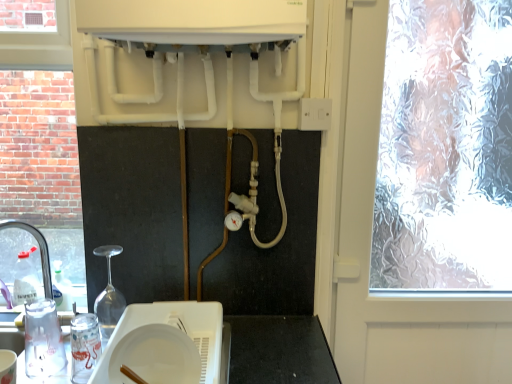
Question: Considering the relative sizes of white plastic switch at upper right and clear plastic tap at left in the image provided, is white plastic switch at upper right bigger than clear plastic tap at left?

Choices:
 (A) no
 (B) yes

Answer: (A)

Question: From a real-world perspective, does white plastic switch at upper right sit lower than clear plastic tap at left?

Choices:
 (A) no
 (B) yes

Answer: (A)

Question: Would you say white plastic switch at upper right is outside clear plastic tap at left?

Choices:
 (A) no
 (B) yes

Answer: (B)

Question: Are white plastic switch at upper right and clear plastic tap at left located far from each other?

Choices:
 (A) yes
 (B) no

Answer: (B)

Question: Is white plastic switch at upper right turned away from clear plastic tap at left?

Choices:
 (A) yes
 (B) no

Answer: (B)

Question: Is white plastic switch at upper right shorter than clear plastic tap at left?

Choices:
 (A) no
 (B) yes

Answer: (B)

Question: Can you confirm if frosted glass window at right is thinner than clear plastic tap at left?

Choices:
 (A) yes
 (B) no

Answer: (B)

Question: From the image's perspective, does frosted glass window at right appear lower than clear plastic tap at left?

Choices:
 (A) no
 (B) yes

Answer: (A)

Question: Considering the relative positions of frosted glass window at right and clear plastic tap at left in the image provided, is frosted glass window at right behind clear plastic tap at left?

Choices:
 (A) no
 (B) yes

Answer: (A)

Question: Does frosted glass window at right have a smaller size compared to clear plastic tap at left?

Choices:
 (A) yes
 (B) no

Answer: (B)

Question: Could you tell me if frosted glass window at right is facing clear plastic tap at left?

Choices:
 (A) yes
 (B) no

Answer: (B)

Question: From the image's perspective, does frosted glass window at right appear higher than clear plastic tap at left?

Choices:
 (A) no
 (B) yes

Answer: (B)

Question: From a real-world perspective, is white matte plate at center beneath frosted glass window at right?

Choices:
 (A) no
 (B) yes

Answer: (B)